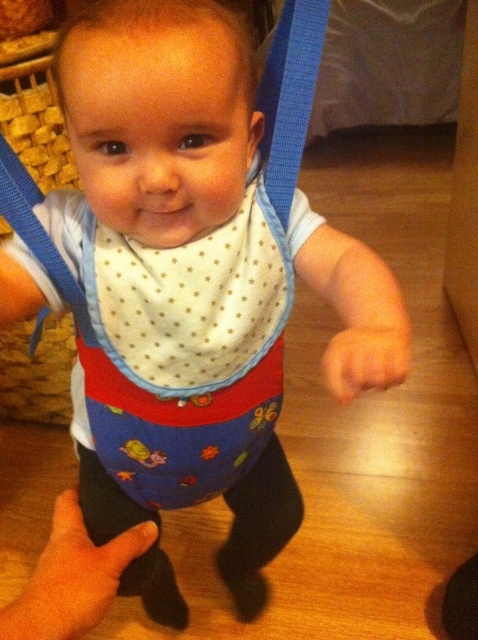
Question: Which point is closer to the camera taking this photo?

Choices:
 (A) (192, 288)
 (B) (286, 100)

Answer: (B)

Question: Among these objects, which one is farthest from the camera?

Choices:
 (A) blue fabric strap at upper center
 (B) white dotted fabric bib at center

Answer: (B)

Question: Can you confirm if white dotted fabric bib at center is wider than blue fabric strap at upper center?

Choices:
 (A) no
 (B) yes

Answer: (B)

Question: Does white dotted fabric bib at center appear on the left side of blue fabric strap at upper center?

Choices:
 (A) yes
 (B) no

Answer: (A)

Question: Is white dotted fabric bib at center below blue fabric strap at upper center?

Choices:
 (A) no
 (B) yes

Answer: (B)